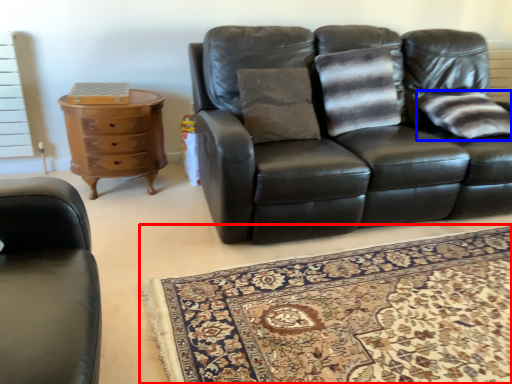
Question: Which of the following is the farthest to the observer, mat (highlighted by a red box) or pillow (highlighted by a blue box)?

Choices:
 (A) mat
 (B) pillow

Answer: (B)